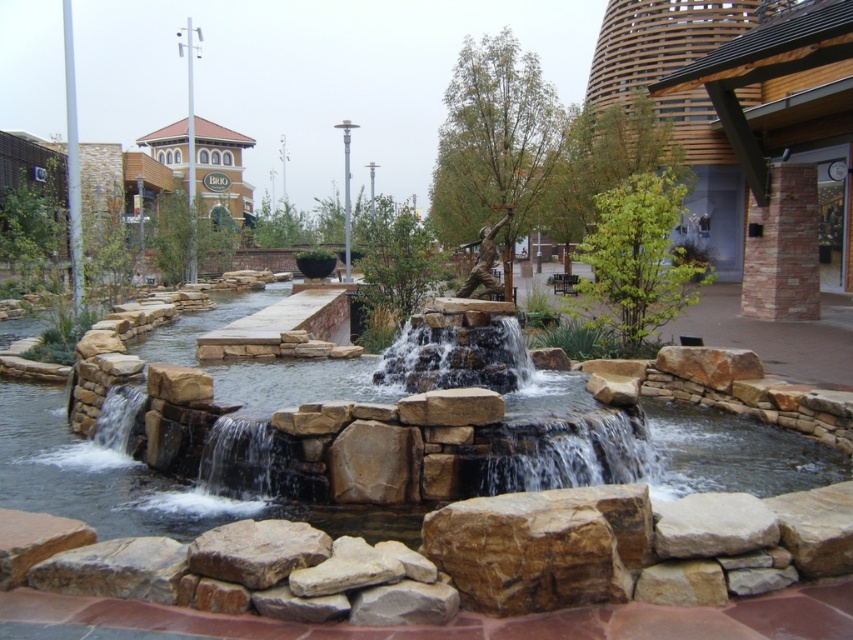
Which is below, brown stone waterfall at center or brown rough rock at center?

Positioned lower is brown rough rock at center.

Who is higher up, brown stone waterfall at center or brown rough rock at center?

brown stone waterfall at center

The height and width of the screenshot is (640, 853). What do you see at coordinates (514, 404) in the screenshot?
I see `brown stone waterfall at center` at bounding box center [514, 404].

Identify the location of brown stone waterfall at center. (514, 404).

In the scene shown: Can you confirm if brown stone stream at center is positioned below brown rough rock at center?

No, brown stone stream at center is not below brown rough rock at center.

Is brown stone stream at center closer to camera compared to brown rough rock at center?

No, it is not.

Does point (352, 396) lie in front of point (312, 548)?

No.

Image resolution: width=853 pixels, height=640 pixels. What are the coordinates of `brown stone stream at center` in the screenshot? It's located at (201, 465).

Is brown stone waterfall at center thinner than smooth stone waterfall at lower left?

No.

Does brown stone waterfall at center have a larger size compared to smooth stone waterfall at lower left?

Correct, brown stone waterfall at center is larger in size than smooth stone waterfall at lower left.

In order to click on brown stone waterfall at center in this screenshot , I will do `click(514, 404)`.